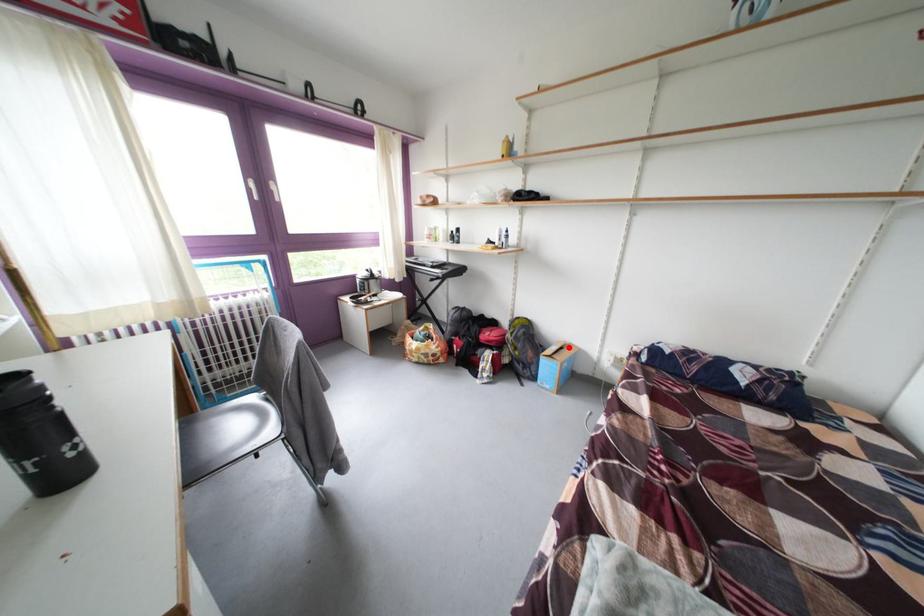
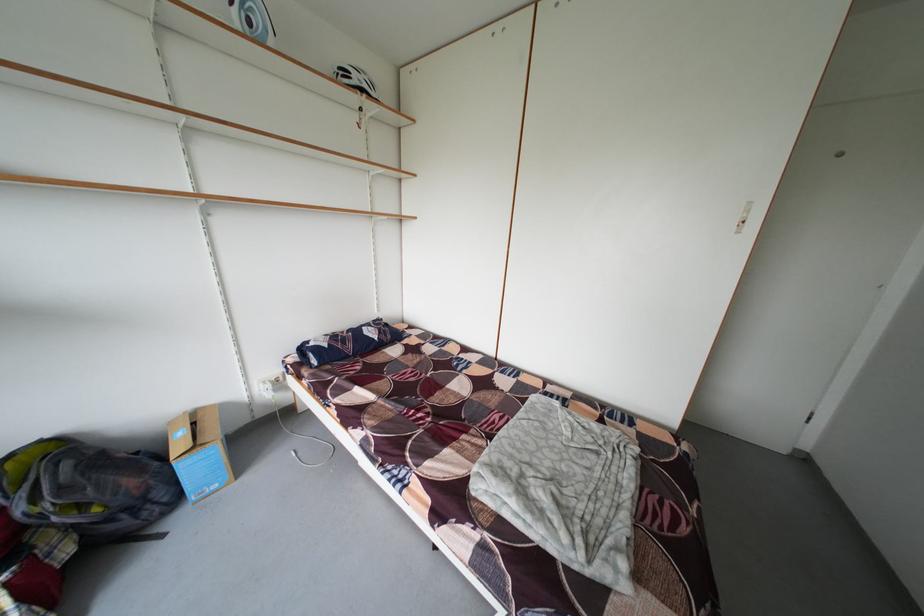
The point at the highlighted location is marked in the first image. Where is the corresponding point in the second image?

(181, 428)